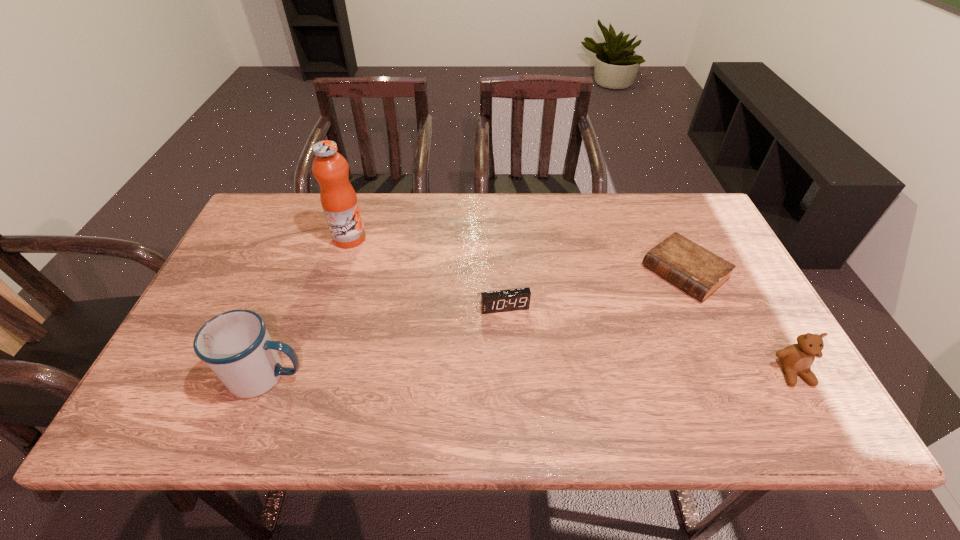
Identify the location of vacant space on the desktop that is between the mug and the third tallest object and is positioned on the front label of the tallest object. The width and height of the screenshot is (960, 540). (523, 374).

The height and width of the screenshot is (540, 960). In order to click on free space on the desktop that is between the mug and the third tallest object and is positioned on the front-facing side of the second shortest object in this screenshot , I will do `click(521, 374)`.

The height and width of the screenshot is (540, 960). Find the location of `vacant space on the desktop that is between the fourth shortest object and the teddy bear and is positioned on the spine side of the diary`. vacant space on the desktop that is between the fourth shortest object and the teddy bear and is positioned on the spine side of the diary is located at coordinates (559, 374).